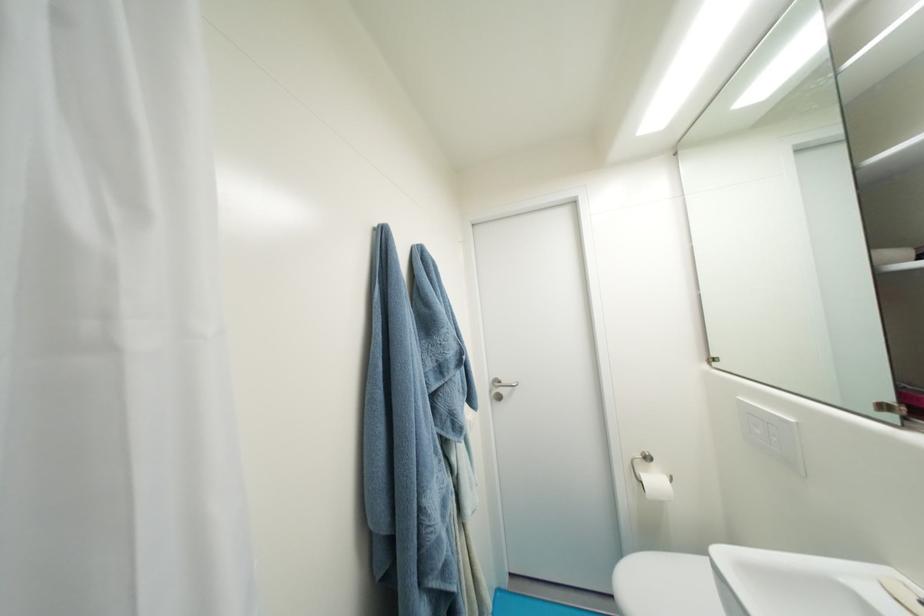
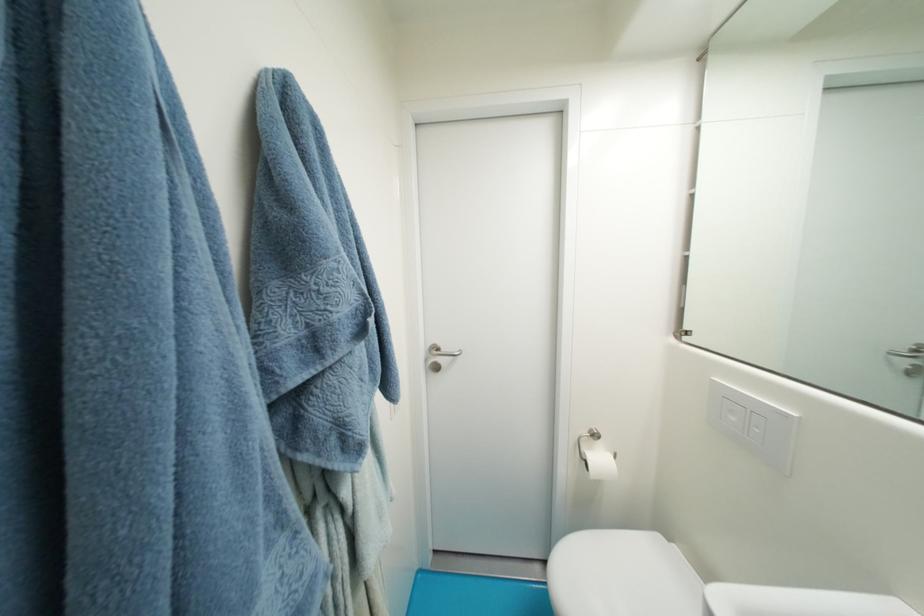
Question: Based on the continuous images, in which direction is the camera rotating? Reply with the corresponding letter.

Choices:
 (A) Left
 (B) Right
 (C) Up
 (D) Down

Answer: (B)